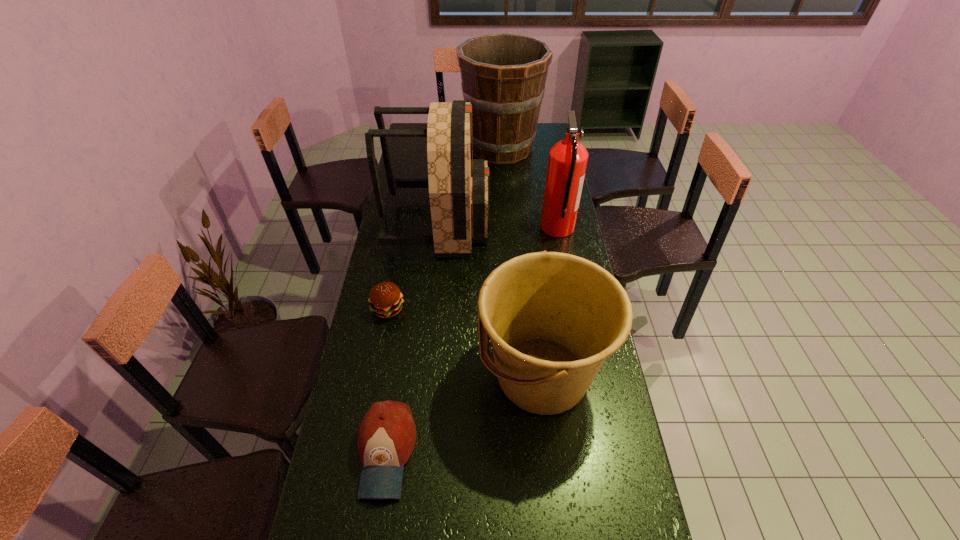
Where is `hamburger present at the left edge`? hamburger present at the left edge is located at coordinates (385, 298).

Locate an element on the screen. Image resolution: width=960 pixels, height=540 pixels. fire extinguisher located in the right edge section of the desktop is located at coordinates (567, 162).

Where is `object present at the far right corner`? object present at the far right corner is located at coordinates [x=503, y=75].

The height and width of the screenshot is (540, 960). In order to click on vacant space at the left edge of the desktop in this screenshot , I will do `click(415, 179)`.

At what (x,y) coordinates should I click in order to perform the action: click on vacant region at the far right corner of the desktop. Please return your answer as a coordinate pair (x, y). Looking at the image, I should click on (543, 142).

Image resolution: width=960 pixels, height=540 pixels. Identify the location of free space between the baseball cap and the fourth tallest object. (464, 414).

Locate an element on the screen. free spot between the third nearest object and the third shortest object is located at coordinates [x=465, y=342].

Image resolution: width=960 pixels, height=540 pixels. What are the coordinates of `free space between the nearer bucket and the baseball cap` in the screenshot? It's located at (464, 414).

Image resolution: width=960 pixels, height=540 pixels. Identify the location of unoccupied area between the fire extinguisher and the taller bucket. (529, 188).

At what (x,y) coordinates should I click in order to perform the action: click on vacant area between the fire extinguisher and the backpack. Please return your answer as a coordinate pair (x, y). The width and height of the screenshot is (960, 540). Looking at the image, I should click on (498, 226).